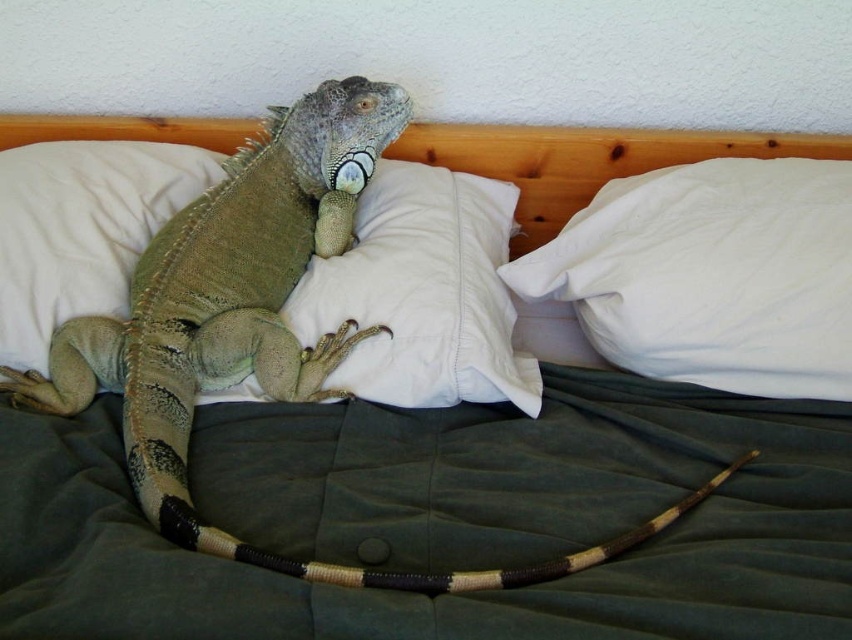
Question: Is white soft pillow at upper right closer to camera compared to green textured pillow at center?

Choices:
 (A) no
 (B) yes

Answer: (B)

Question: Which point is farther to the camera?

Choices:
 (A) white soft pillow at center
 (B) white soft pillow at upper right
 (C) green textured pillow at center

Answer: (C)

Question: Which object appears farthest from the camera in this image?

Choices:
 (A) white soft pillow at center
 (B) white soft pillow at upper right

Answer: (A)

Question: Can you confirm if white soft pillow at upper right is wider than green textured pillow at center?

Choices:
 (A) yes
 (B) no

Answer: (A)

Question: Considering the relative positions of white soft pillow at upper right and white soft pillow at center in the image provided, where is white soft pillow at upper right located with respect to white soft pillow at center?

Choices:
 (A) left
 (B) right

Answer: (B)

Question: Among these points, which one is nearest to the camera?

Choices:
 (A) (793, 266)
 (B) (15, 362)
 (C) (378, 252)

Answer: (A)